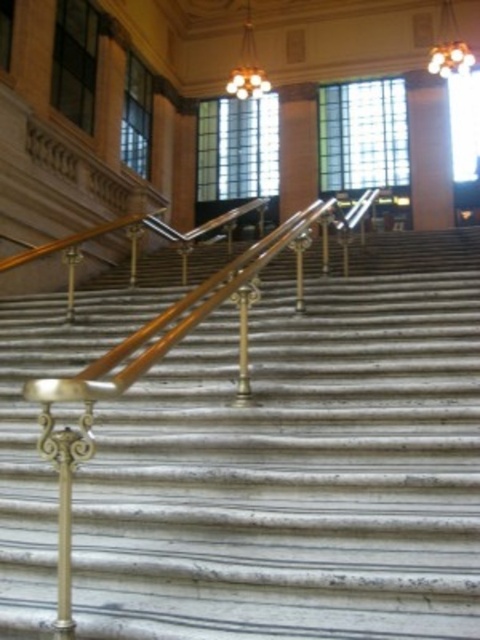
Can you confirm if golden glass chandelier at upper center is positioned above gold textured chandelier at upper center?

Indeed, golden glass chandelier at upper center is positioned over gold textured chandelier at upper center.

Does golden glass chandelier at upper center have a greater width compared to gold textured chandelier at upper center?

Correct, the width of golden glass chandelier at upper center exceeds that of gold textured chandelier at upper center.

Which is in front, point (450, 65) or point (260, 90)?

Point (450, 65)

At what (x,y) coordinates should I click in order to perform the action: click on golden glass chandelier at upper center. Please return your answer as a coordinate pair (x, y). Image resolution: width=480 pixels, height=640 pixels. Looking at the image, I should click on (450, 45).

Does white marble pillar at upper center appear on the right side of gold textured chandelier at upper center?

Indeed, white marble pillar at upper center is positioned on the right side of gold textured chandelier at upper center.

Is white marble pillar at upper center below gold textured chandelier at upper center?

Indeed, white marble pillar at upper center is positioned under gold textured chandelier at upper center.

I want to click on white marble pillar at upper center, so click(x=429, y=150).

At what (x,y) coordinates should I click in order to perform the action: click on white marble pillar at upper center. Please return your answer as a coordinate pair (x, y). This screenshot has height=640, width=480. Looking at the image, I should click on (429, 150).

Is white marble pillar at upper center thinner than golden glass chandelier at upper center?

Yes.

Does point (427, 176) lie in front of point (456, 24)?

Yes, point (427, 176) is closer to viewer.

Is point (430, 152) positioned behind point (448, 36)?

That is False.

Locate an element on the screen. This screenshot has height=640, width=480. white marble pillar at upper center is located at coordinates (429, 150).